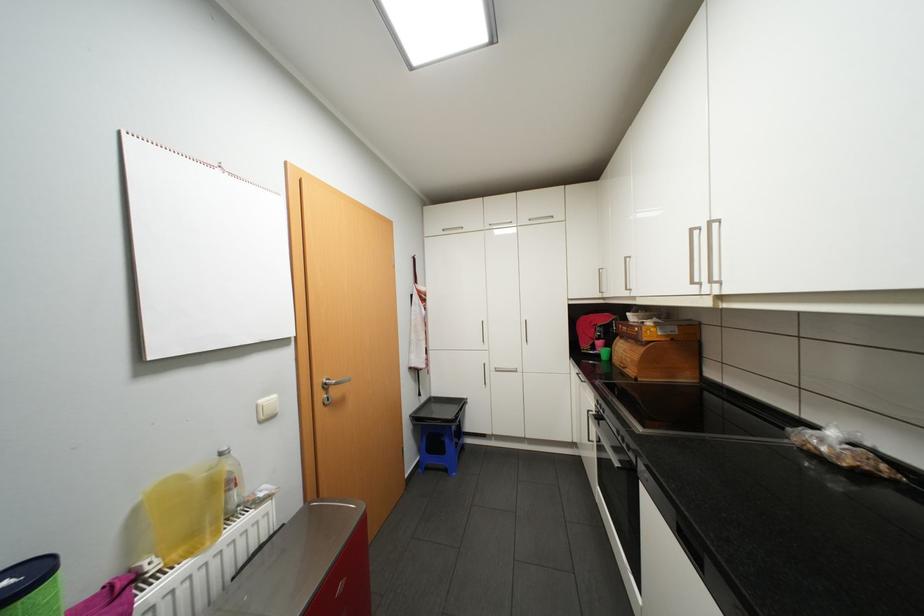
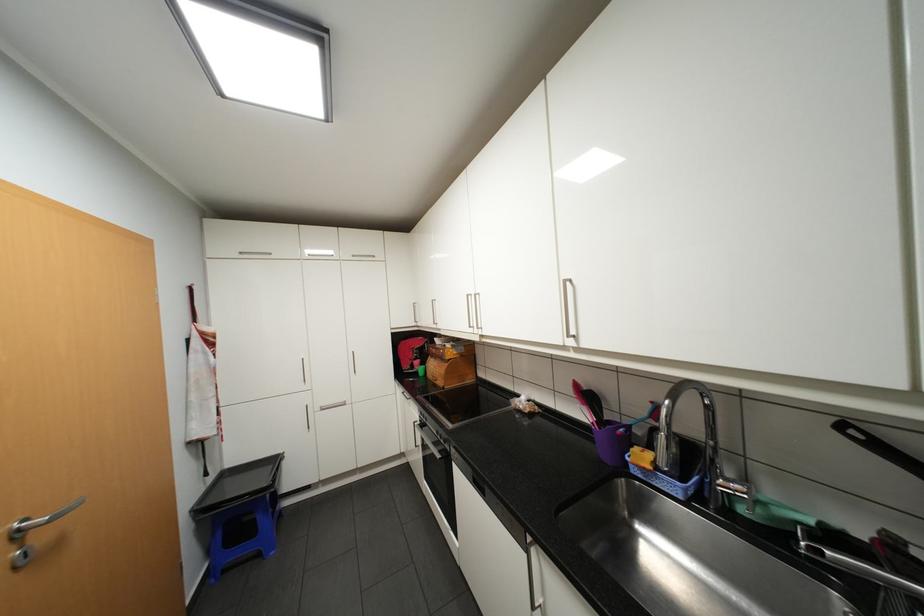
Locate, in the second image, the point that corresponds to the point at 699,229 in the first image.

(476, 294)